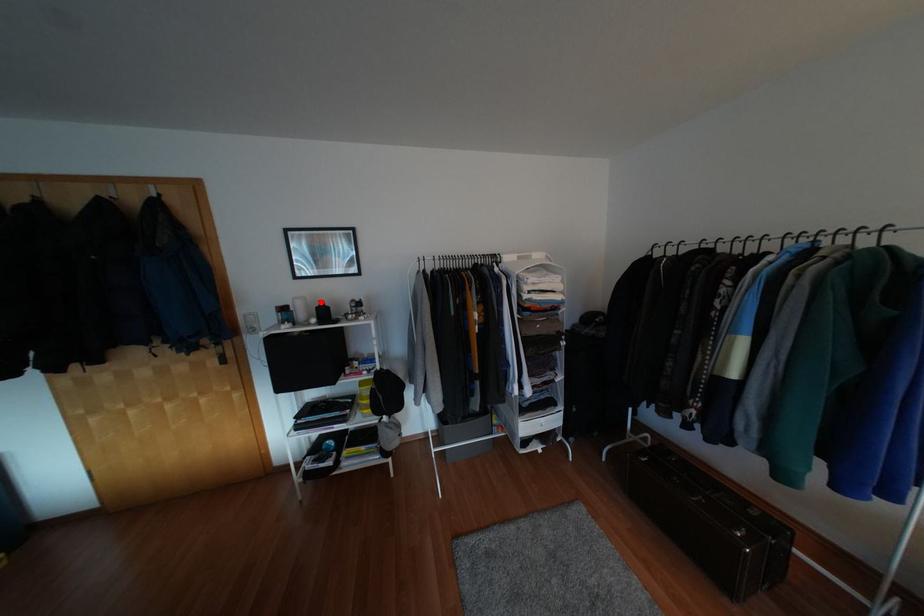
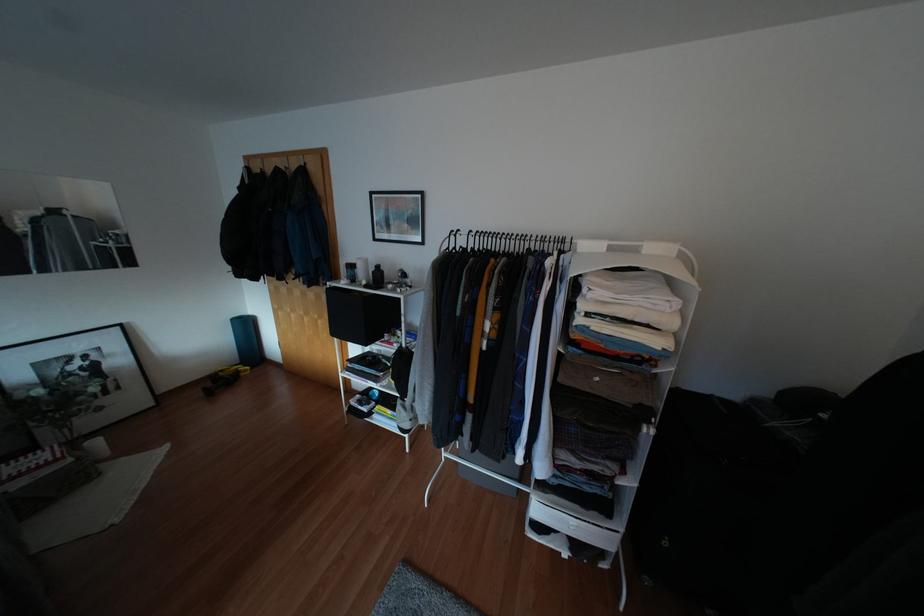
In the second image, find the point that corresponds to the highlighted location in the first image.

(377, 265)